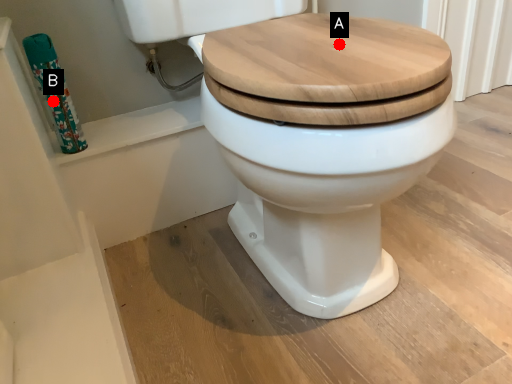
Question: Two points are circled on the image, labeled by A and B beside each circle. Which of the following is the farthest from the observer?

Choices:
 (A) A is further
 (B) B is further

Answer: (B)